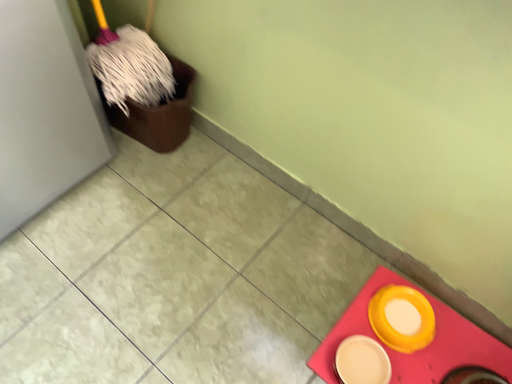
Question: Does matte yellow plate at lower right, marked as the 1th tableware in a left-to-right arrangement, have a smaller size compared to yellow matte bowl at lower right, the first tableware in the right-to-left sequence?

Choices:
 (A) yes
 (B) no

Answer: (A)

Question: Is the surface of matte yellow plate at lower right, marked as the 1th tableware in a left-to-right arrangement, in direct contact with yellow matte bowl at lower right, the 2th tableware from the left?

Choices:
 (A) no
 (B) yes

Answer: (B)

Question: Is the depth of matte yellow plate at lower right, marked as the 1th tableware in a left-to-right arrangement, less than that of yellow matte bowl at lower right, the first tableware in the right-to-left sequence?

Choices:
 (A) yes
 (B) no

Answer: (A)

Question: Is matte yellow plate at lower right, which ranks as the 2th tableware in right-to-left order, oriented away from yellow matte bowl at lower right, the first tableware in the right-to-left sequence?

Choices:
 (A) yes
 (B) no

Answer: (A)

Question: Would you say matte yellow plate at lower right, marked as the 1th tableware in a left-to-right arrangement, contains yellow matte bowl at lower right, the 2th tableware from the left?

Choices:
 (A) yes
 (B) no

Answer: (B)

Question: From the image's perspective, is matte yellow plate at lower right, which ranks as the 2th tableware in right-to-left order, below yellow matte bowl at lower right, the 2th tableware from the left?

Choices:
 (A) no
 (B) yes

Answer: (B)

Question: From the image's perspective, is yellow matte bowl at lower right, the 2th tableware from the left, beneath matte yellow bowl at lower right?

Choices:
 (A) no
 (B) yes

Answer: (A)

Question: Does yellow matte bowl at lower right, the first tableware in the right-to-left sequence, touch matte yellow bowl at lower right?

Choices:
 (A) no
 (B) yes

Answer: (B)

Question: Can you confirm if yellow matte bowl at lower right, the 2th tableware from the left, is thinner than matte yellow bowl at lower right?

Choices:
 (A) yes
 (B) no

Answer: (A)

Question: From a real-world perspective, is yellow matte bowl at lower right, the 2th tableware from the left, located beneath matte yellow bowl at lower right?

Choices:
 (A) no
 (B) yes

Answer: (A)

Question: Is the position of yellow matte bowl at lower right, the first tableware in the right-to-left sequence, more distant than that of matte yellow bowl at lower right?

Choices:
 (A) yes
 (B) no

Answer: (A)

Question: Does yellow matte bowl at lower right, the first tableware in the right-to-left sequence, appear on the right side of matte yellow bowl at lower right?

Choices:
 (A) yes
 (B) no

Answer: (B)

Question: Can you confirm if yellow matte bowl at lower right, the 2th tableware from the left, is smaller than matte yellow plate at lower right, marked as the 1th tableware in a left-to-right arrangement?

Choices:
 (A) yes
 (B) no

Answer: (B)